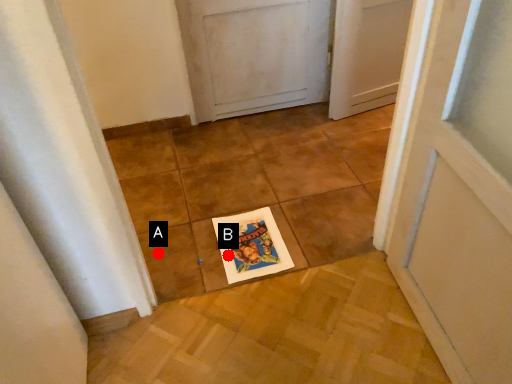
Question: Two points are circled on the image, labeled by A and B beside each circle. Which point is further to the camera?

Choices:
 (A) A is further
 (B) B is further

Answer: (A)